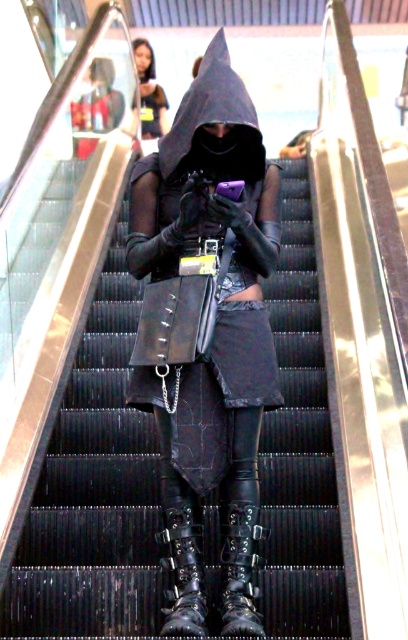
Question: Which of the following is the closest to the observer?

Choices:
 (A) (141, 61)
 (B) (161, 256)
 (C) (224, 620)
 (D) (115, 276)

Answer: (C)

Question: Does black leather bag at center appear under leather/black boots at lower center?

Choices:
 (A) yes
 (B) no

Answer: (B)

Question: Is black leather boot at center above leather/black boots at lower center?

Choices:
 (A) no
 (B) yes

Answer: (B)

Question: Does black leather bag at center have a lesser width compared to matte black hoodie at upper center?

Choices:
 (A) yes
 (B) no

Answer: (B)

Question: Which object is positioned closest to the black leather bag at center?

Choices:
 (A) black leather boot at center
 (B) matte black hoodie at upper center
 (C) matte black hoodie at center
 (D) leather/black boots at lower center

Answer: (D)

Question: Which object is positioned farthest from the black leather boot at center?

Choices:
 (A) black leather bag at center
 (B) matte black hoodie at upper center
 (C) matte black hoodie at center

Answer: (B)